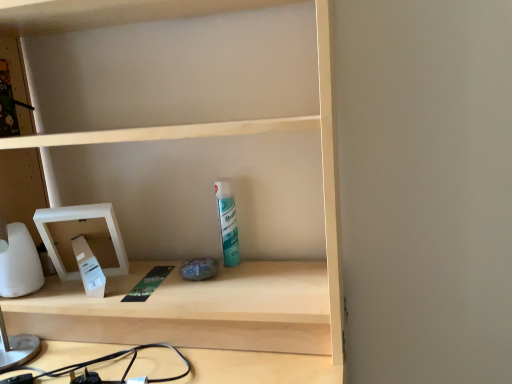
Question: Looking at their shapes, would you say white glossy can at center is wider or thinner than white plastic medicine cabinet at left?

Choices:
 (A) thin
 (B) wide

Answer: (A)

Question: Is white glossy can at center in front of or behind white plastic medicine cabinet at left in the image?

Choices:
 (A) behind
 (B) front

Answer: (A)

Question: Considering the positions of point (224, 200) and point (67, 211), is point (224, 200) closer or farther from the camera than point (67, 211)?

Choices:
 (A) farther
 (B) closer

Answer: (A)

Question: From the image's perspective, relative to white glossy can at center, is white plastic medicine cabinet at left above or below?

Choices:
 (A) below
 (B) above

Answer: (A)

Question: Considering their positions, is white plastic medicine cabinet at left located in front of or behind white glossy can at center?

Choices:
 (A) front
 (B) behind

Answer: (A)

Question: In the image, is white plastic medicine cabinet at left on the left side or the right side of white glossy can at center?

Choices:
 (A) left
 (B) right

Answer: (A)

Question: Is white plastic medicine cabinet at left spatially inside white glossy can at center, or outside of it?

Choices:
 (A) outside
 (B) inside

Answer: (A)